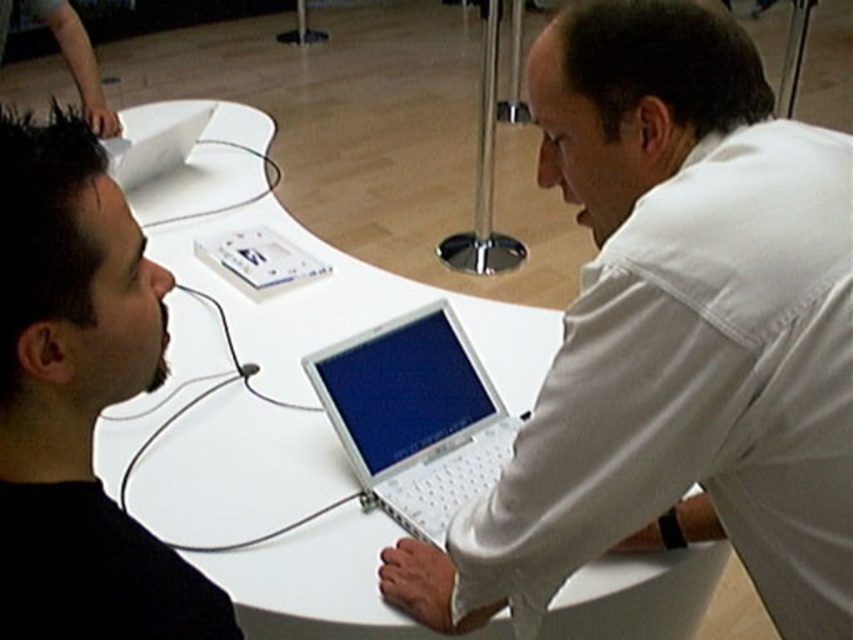
You are a salesperson demonstrating two laptops to a customer. The white matte laptop at center and the silver metallic laptop at center are both on the table. The customer asks which laptop is wider. What do you tell them?

The white matte laptop at center is wider than the silver metallic laptop at center.

You are a delivery person who needs to place a new laptop that is 0.5 meters long between the silver metallic laptop at center and the white plastic laptop at upper left. Is there enough space between them to fit the new laptop without moving the existing ones?

The distance between the silver metallic laptop at center and the white plastic laptop at upper left is 1.19 meters. Since the new laptop is 0.5 meters long, there is sufficient space to place it between them without moving the existing laptops.